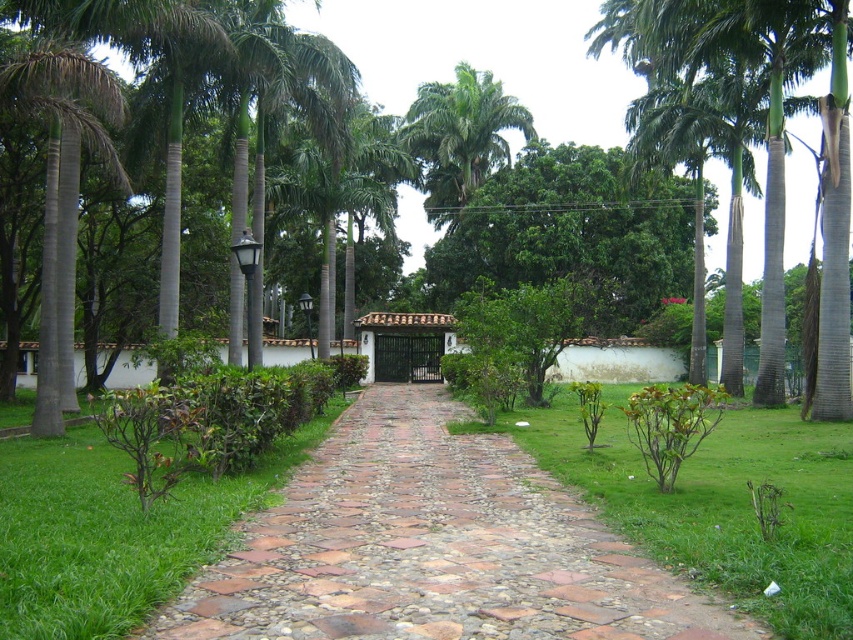
Question: Does green grass at center have a lesser width compared to green leafy palm tree at left?

Choices:
 (A) yes
 (B) no

Answer: (B)

Question: Based on their relative distances, which object is farther from the green leafy palm tree at upper center?

Choices:
 (A) brown cobblestone path at center
 (B) green grass at center
 (C) green grass at lower left
 (D) green leafy palm tree at left

Answer: (C)

Question: Is green grass at center in front of green leafy palm tree at left?

Choices:
 (A) yes
 (B) no

Answer: (A)

Question: Considering the real-world distances, which object is closest to the brown cobblestone path at center?

Choices:
 (A) green grass at center
 (B) green leafy palm tree at left

Answer: (A)

Question: Does green grass at center have a lesser width compared to green leafy palm tree at upper center?

Choices:
 (A) yes
 (B) no

Answer: (B)

Question: Which of the following is the farthest from the observer?

Choices:
 (A) click(834, 179)
 (B) click(96, 115)
 (C) click(96, 611)

Answer: (B)